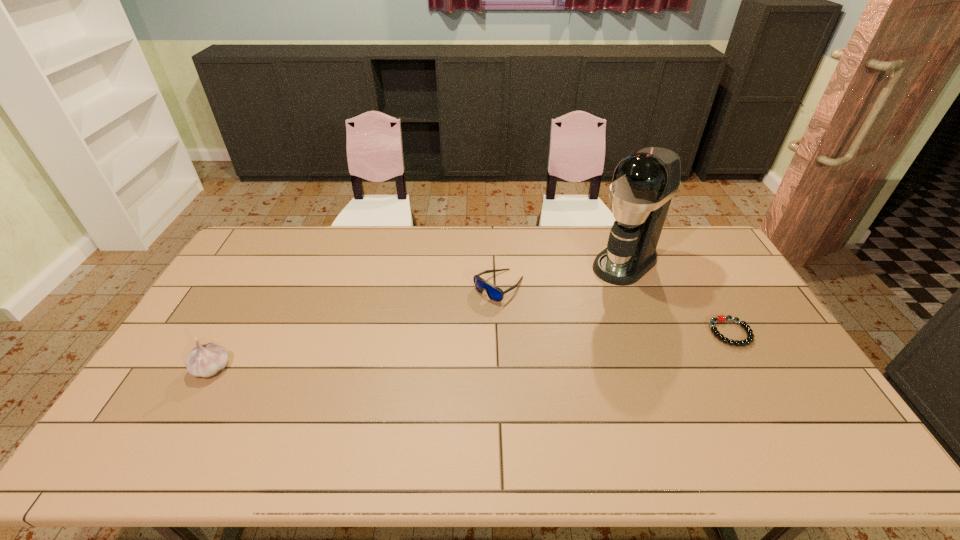
I want to click on free space between the tallest object and the garlic, so click(419, 315).

The width and height of the screenshot is (960, 540). I want to click on vacant space that's between the third farthest object and the second shortest object, so click(614, 309).

Locate an element on the screen. vacant region between the garlic and the second object from left to right is located at coordinates coord(355,327).

The image size is (960, 540). I want to click on object that stands as the third closest to the nearest object, so click(720, 318).

Identify the location of object that is the third closest to the sunglasses. (205, 360).

Where is `free space in the image that satisfies the following two spatial constraints: 1. on the front side of the shortest object; 2. on the right side of the third tallest object`? This screenshot has height=540, width=960. free space in the image that satisfies the following two spatial constraints: 1. on the front side of the shortest object; 2. on the right side of the third tallest object is located at coordinates (501, 333).